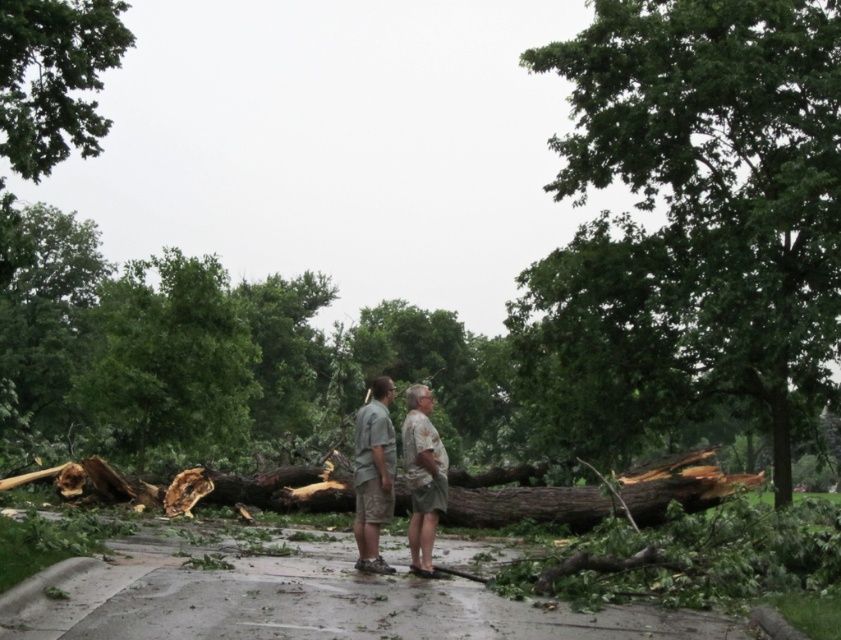
You are a person who is standing on the wet paved surface and looking at the two people in the scene. Which of the two items, the camouflage shorts at center or the camouflage shirt at center, is positioned to the left?

The camouflage shorts at center is positioned to the left of the camouflage shirt at center.

You are standing on the wet paved surface and want to walk towards the green leafy tree at upper left. Which direction should you turn to avoid the green rough bark tree at center?

You should turn to the left to avoid the green rough bark tree at center, as it is to the right of the green leafy tree at upper left.

You are a photographer trying to capture a detailed image of both camouflage fabric shorts at center and camouflage shorts at center. Which one should you focus on first if you want to ensure both are in frame without moving the camera?

You should focus on the camouflage fabric shorts at center first since it is shorter than the camouflage shorts at center. By focusing on the shorter one first, you can adjust the camera angle to include both in the frame without moving the camera.